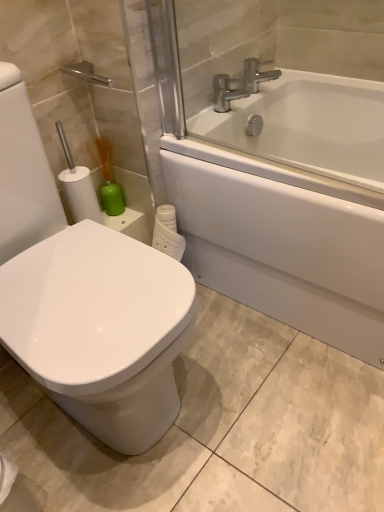
Question: From the image's perspective, is green matte soap dispenser at left on silver metallic faucet at upper center?

Choices:
 (A) no
 (B) yes

Answer: (A)

Question: Are green matte soap dispenser at left and silver metallic faucet at upper center beside each other?

Choices:
 (A) yes
 (B) no

Answer: (B)

Question: Is the position of green matte soap dispenser at left less distant than that of silver metallic faucet at upper center?

Choices:
 (A) yes
 (B) no

Answer: (A)

Question: Is green matte soap dispenser at left to the right of silver metallic faucet at upper center from the viewer's perspective?

Choices:
 (A) yes
 (B) no

Answer: (B)

Question: Considering the relative sizes of green matte soap dispenser at left and silver metallic faucet at upper center in the image provided, is green matte soap dispenser at left smaller than silver metallic faucet at upper center?

Choices:
 (A) yes
 (B) no

Answer: (A)

Question: From a real-world perspective, is green matte soap dispenser at left positioned over silver metallic faucet at upper center based on gravity?

Choices:
 (A) yes
 (B) no

Answer: (B)

Question: Is white glossy bathtub at upper right at the back of silver metallic faucet at upper center?

Choices:
 (A) yes
 (B) no

Answer: (B)

Question: From the image's perspective, is silver metallic faucet at upper center located beneath white glossy bathtub at upper right?

Choices:
 (A) no
 (B) yes

Answer: (A)

Question: Is the position of silver metallic faucet at upper center more distant than that of white glossy bathtub at upper right?

Choices:
 (A) yes
 (B) no

Answer: (A)

Question: Does silver metallic faucet at upper center have a greater height compared to white glossy bathtub at upper right?

Choices:
 (A) no
 (B) yes

Answer: (A)

Question: Considering the relative sizes of silver metallic faucet at upper center and white glossy bathtub at upper right in the image provided, is silver metallic faucet at upper center wider than white glossy bathtub at upper right?

Choices:
 (A) no
 (B) yes

Answer: (A)

Question: Is silver metallic faucet at upper center outside of white glossy bathtub at upper right?

Choices:
 (A) yes
 (B) no

Answer: (B)

Question: Is white glossy bidet at left surrounded by silver metallic faucet at upper center?

Choices:
 (A) no
 (B) yes

Answer: (A)